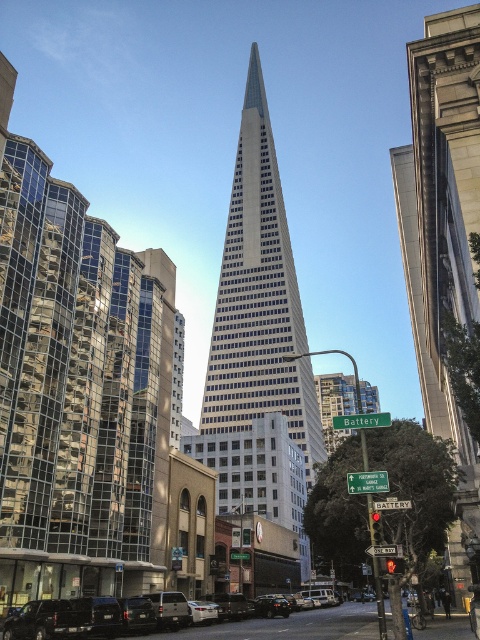
Who is more forward, (368, 636) or (201, 602)?

Positioned in front is point (368, 636).

Does point (312, 621) lie behind point (192, 602)?

Yes, it is behind point (192, 602).

This screenshot has height=640, width=480. I want to click on black matte suv at center, so click(288, 625).

Is gray stone building at right thinner than silver metallic sedan at center?

In fact, gray stone building at right might be wider than silver metallic sedan at center.

Can you confirm if gray stone building at right is smaller than silver metallic sedan at center?

Incorrect, gray stone building at right is not smaller in size than silver metallic sedan at center.

Which is behind, point (455, 205) or point (195, 609)?

Point (195, 609)

This screenshot has width=480, height=640. In order to click on gray stone building at right in this screenshot , I will do `click(443, 236)`.

Is shiny black sedan at center smaller than silver metallic sedan at center?

Yes.

Is shiny black sedan at center below silver metallic sedan at center?

Indeed, shiny black sedan at center is positioned under silver metallic sedan at center.

Measure the distance between point (269, 616) and camera.

Point (269, 616) and camera are 53.87 meters apart from each other.

Where is `shiny black sedan at center`? This screenshot has width=480, height=640. shiny black sedan at center is located at coordinates (271, 605).